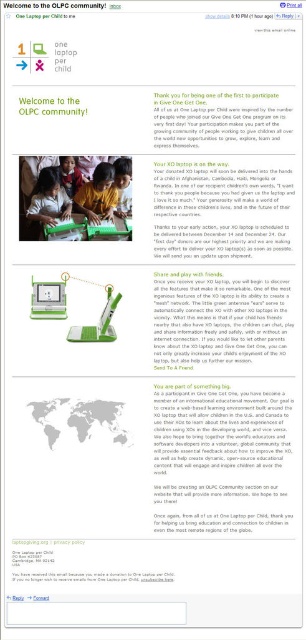
Does black glossy text at lower center appear on the left side of green matte laptop at center?

Yes, black glossy text at lower center is to the left of green matte laptop at center.

What do you see at coordinates (93, 577) in the screenshot?
I see `black glossy text at lower center` at bounding box center [93, 577].

Where is `black glossy text at lower center`? This screenshot has height=640, width=306. black glossy text at lower center is located at coordinates (93, 577).

This screenshot has height=640, width=306. I want to click on black glossy text at lower center, so click(x=93, y=577).

Is point (208, 323) farther from camera compared to point (88, 576)?

Yes, it is.

Can you confirm if matte green laptop at center is wider than black glossy text at lower center?

Incorrect, matte green laptop at center's width does not surpass black glossy text at lower center's.

This screenshot has height=640, width=306. I want to click on matte green laptop at center, so click(217, 320).

What do you see at coordinates (48, 300) in the screenshot? Image resolution: width=306 pixels, height=640 pixels. I see `matte white computer at center` at bounding box center [48, 300].

Can you confirm if matte white computer at center is shorter than green matte laptop at center?

Yes, matte white computer at center is shorter than green matte laptop at center.

Is point (48, 288) positioned behind point (85, 336)?

Yes.

Identify the location of matte white computer at center. (48, 300).